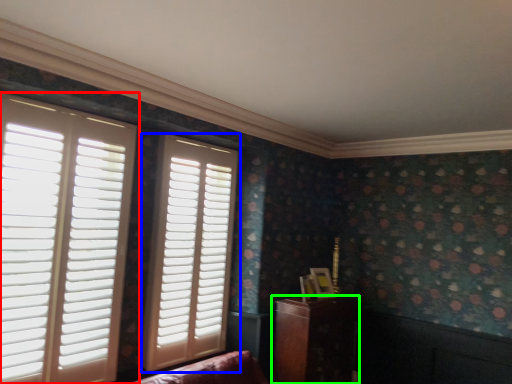
Question: Which object is positioned farthest from window (highlighted by a red box)? Select from window (highlighted by a blue box) and furniture (highlighted by a green box).

Choices:
 (A) window
 (B) furniture

Answer: (B)